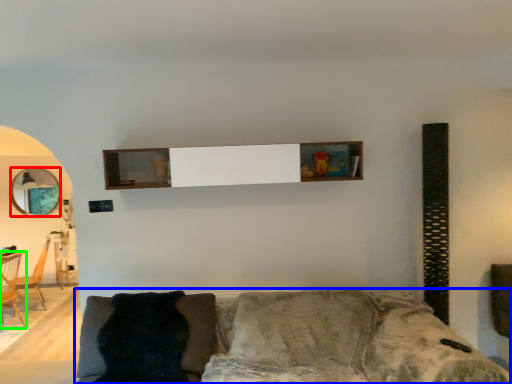
Question: Which is nearer to the mirror (highlighted by a red box)? studio couch (highlighted by a blue box) or armchair (highlighted by a green box).

Choices:
 (A) studio couch
 (B) armchair

Answer: (B)